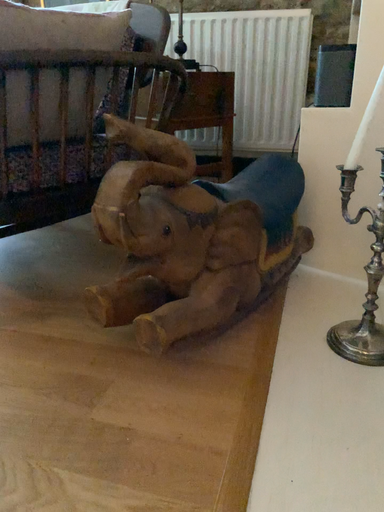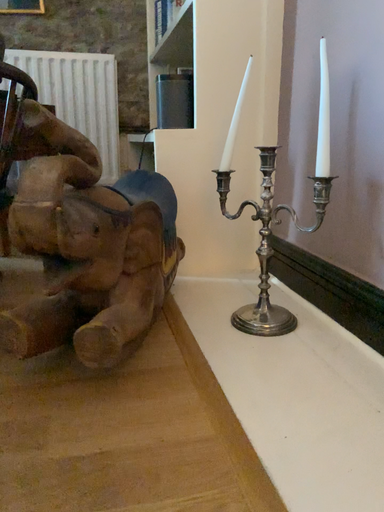
Question: How did the camera likely rotate when shooting the video?

Choices:
 (A) rotated left
 (B) rotated right

Answer: (B)